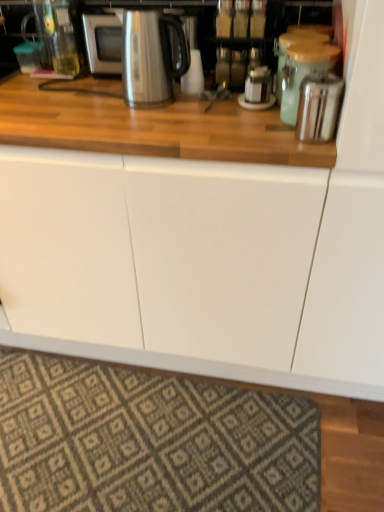
Question: Is the surface of stainless steel kettle at upper center in direct contact with green matte jar at upper right, acting as the second appliance starting from the back?

Choices:
 (A) no
 (B) yes

Answer: (A)

Question: Is stainless steel kettle at upper center taller than green matte jar at upper right, acting as the second appliance starting from the back?

Choices:
 (A) no
 (B) yes

Answer: (B)

Question: Is stainless steel kettle at upper center positioned far away from green matte jar at upper right, which appears as the 2th appliance when viewed from the front?

Choices:
 (A) yes
 (B) no

Answer: (B)

Question: Does stainless steel kettle at upper center have a larger size compared to green matte jar at upper right, which appears as the 2th appliance when viewed from the front?

Choices:
 (A) no
 (B) yes

Answer: (B)

Question: Does stainless steel kettle at upper center come in front of green matte jar at upper right, which appears as the 2th appliance when viewed from the front?

Choices:
 (A) yes
 (B) no

Answer: (B)

Question: From the image's perspective, does stainless steel kettle at upper center appear lower than green matte jar at upper right, which appears as the 2th appliance when viewed from the front?

Choices:
 (A) no
 (B) yes

Answer: (A)

Question: Can we say patterned carpet at lower center lies outside green matte jar at upper right, acting as the second appliance starting from the back?

Choices:
 (A) no
 (B) yes

Answer: (B)

Question: From a real-world perspective, is patterned carpet at lower center on green matte jar at upper right, which appears as the 2th appliance when viewed from the front?

Choices:
 (A) yes
 (B) no

Answer: (B)

Question: Are patterned carpet at lower center and green matte jar at upper right, acting as the second appliance starting from the back, making contact?

Choices:
 (A) yes
 (B) no

Answer: (B)

Question: Can you confirm if patterned carpet at lower center is thinner than green matte jar at upper right, which appears as the 2th appliance when viewed from the front?

Choices:
 (A) yes
 (B) no

Answer: (B)

Question: Is patterned carpet at lower center taller than green matte jar at upper right, acting as the second appliance starting from the back?

Choices:
 (A) yes
 (B) no

Answer: (B)

Question: Does patterned carpet at lower center have a larger size compared to green matte jar at upper right, acting as the second appliance starting from the back?

Choices:
 (A) yes
 (B) no

Answer: (A)

Question: Is satin silver toaster at upper right, which appears as the third appliance when viewed from the back, positioned behind metallic silver canister at upper right, arranged as the first appliance when viewed from the back?

Choices:
 (A) no
 (B) yes

Answer: (A)